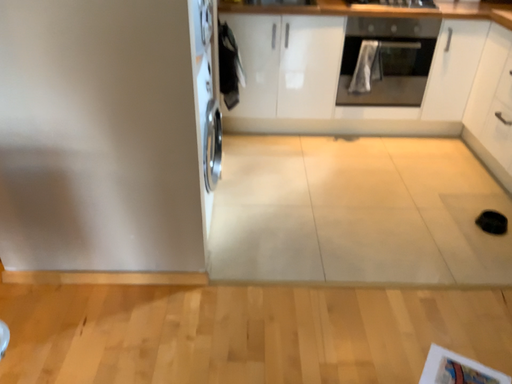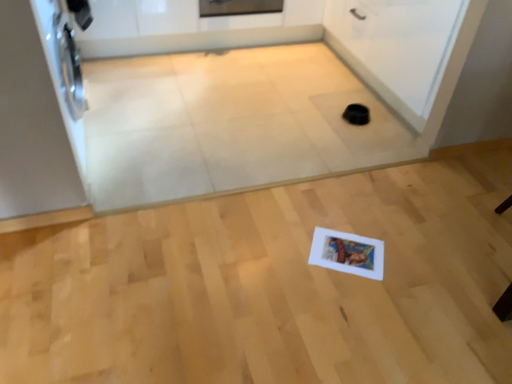
Question: Which way did the camera rotate in the video?

Choices:
 (A) rotated upward
 (B) rotated downward

Answer: (B)